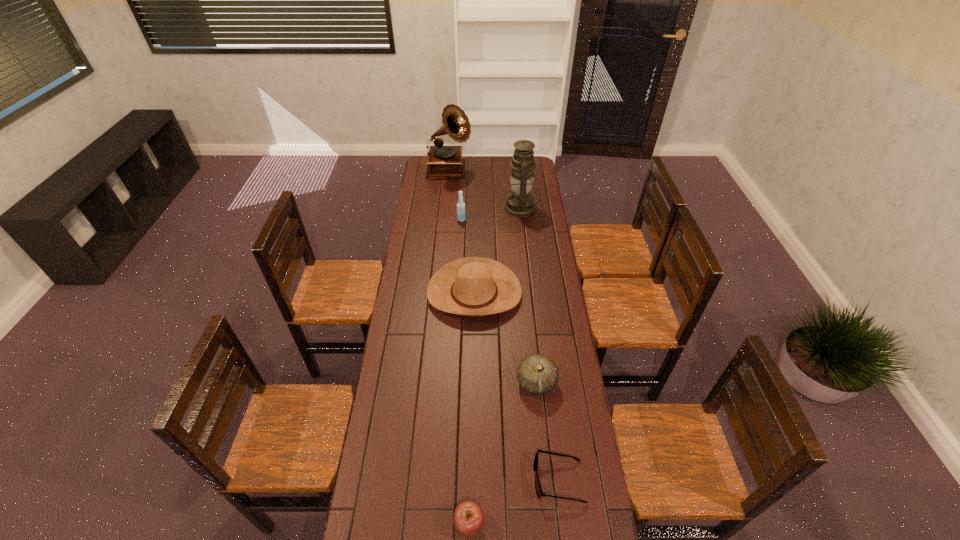
Locate an element on the screen. The width and height of the screenshot is (960, 540). the farthest object is located at coordinates (444, 162).

What are the coordinates of `oil lamp` in the screenshot? It's located at (520, 203).

The height and width of the screenshot is (540, 960). In order to click on bottle in this screenshot , I will do `click(461, 211)`.

Locate an element on the screen. The height and width of the screenshot is (540, 960). the fourth tallest object is located at coordinates (474, 286).

At what (x,y) coordinates should I click in order to perform the action: click on cowboy hat. Please return your answer as a coordinate pair (x, y). The width and height of the screenshot is (960, 540). Looking at the image, I should click on (474, 286).

Find the location of `gourd`. gourd is located at coordinates (537, 374).

Locate an element on the screen. the fifth farthest object is located at coordinates (537, 374).

Find the location of a particular element. The height and width of the screenshot is (540, 960). the second nearest object is located at coordinates (538, 488).

Locate an element on the screen. This screenshot has width=960, height=540. sunglasses is located at coordinates (538, 488).

Where is `vacant space located 0.120m on the horn of the record player`? vacant space located 0.120m on the horn of the record player is located at coordinates (491, 172).